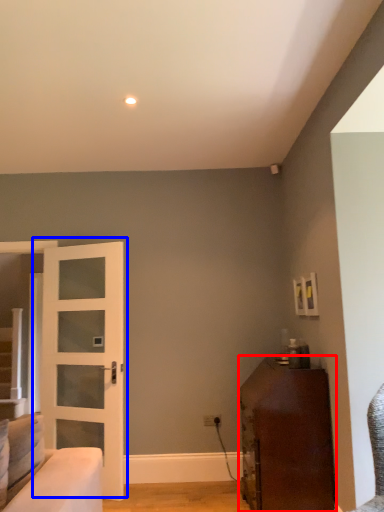
Question: Which object appears farthest to the camera in this image, furniture (highlighted by a red box) or door (highlighted by a blue box)?

Choices:
 (A) furniture
 (B) door

Answer: (B)